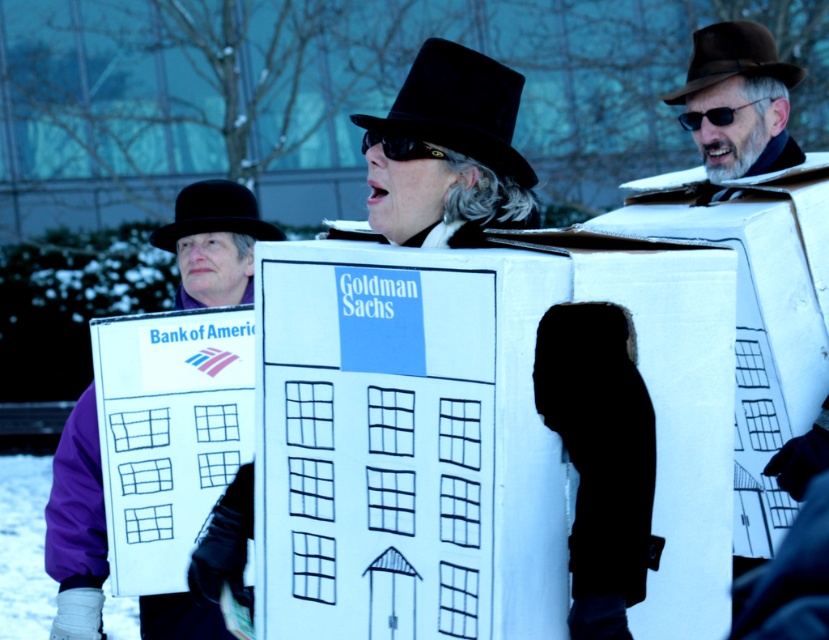
You are a photographer trying to capture the protest scene. You notice two points in the image at coordinates point (731, 307) and point (452, 67). Which point is positioned closer to your camera lens?

Point (731, 307) is closer to the viewer than point (452, 67).

From the picture: You are a photographer taking a picture of the protest scene. You notice two points marked in the image. Which point, point (415, 104) or point (182, 218), is closer to your camera?

Point (415, 104) is closer to the camera than point (182, 218).